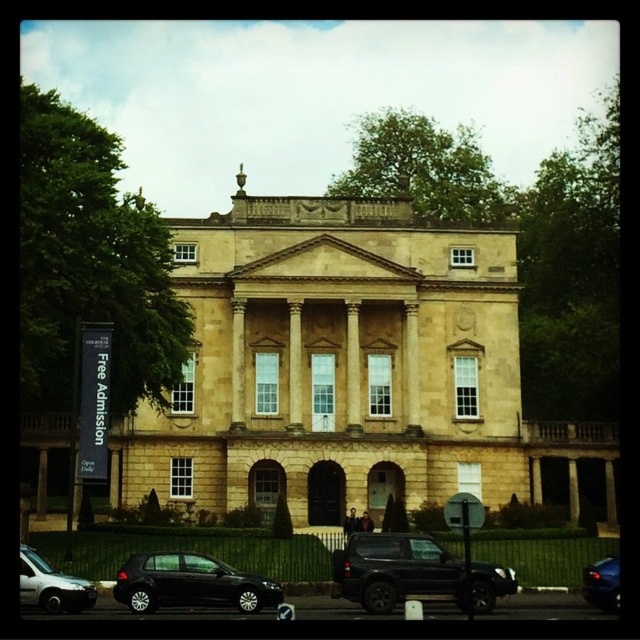
You are a visitor arriving at the building and want to park your car. You see a black matte suv at center and a shiny black car at lower left. Which parking spot is closer to the entrance of the building?

The shiny black car at lower left is closer to the entrance because the black matte suv at center is above it, meaning it is parked further away from the entrance.

You are a visitor arriving at the building and see the black matte suv at center and the shiny black car at lower left. Which vehicle is closer to the central entrance of the building?

The black matte suv at center is closer to the central entrance of the building because it is positioned to the right of the shiny black car at lower left, which places it nearer to the center.

You are a visitor arriving at the classical building. You see a black matte suv at center and a shiny blue sedan at lower right. Which vehicle is closer to the central entrance of the building?

The black matte suv at center is closer to the central entrance of the building because it is positioned on the left side of the shiny blue sedan at lower right, which is further away from the center.